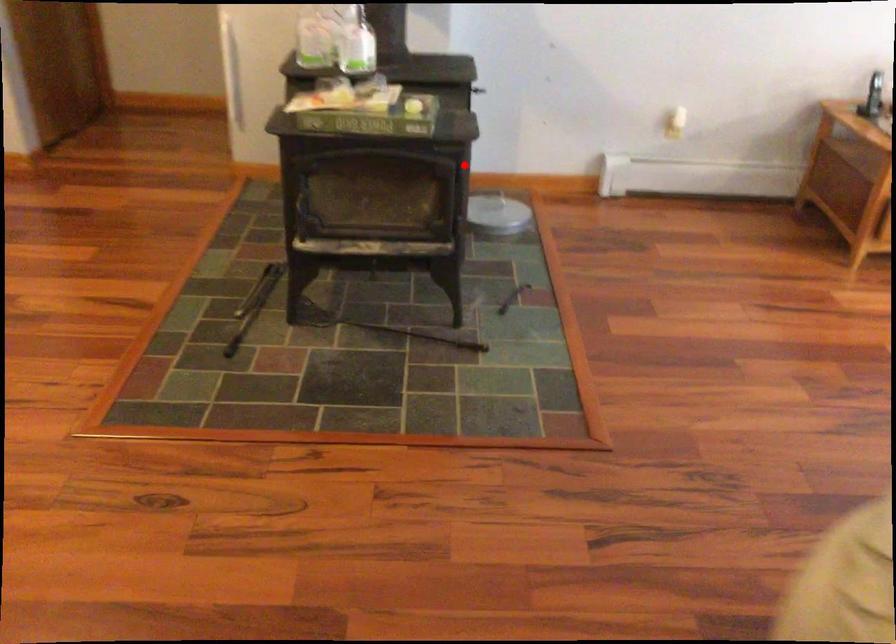
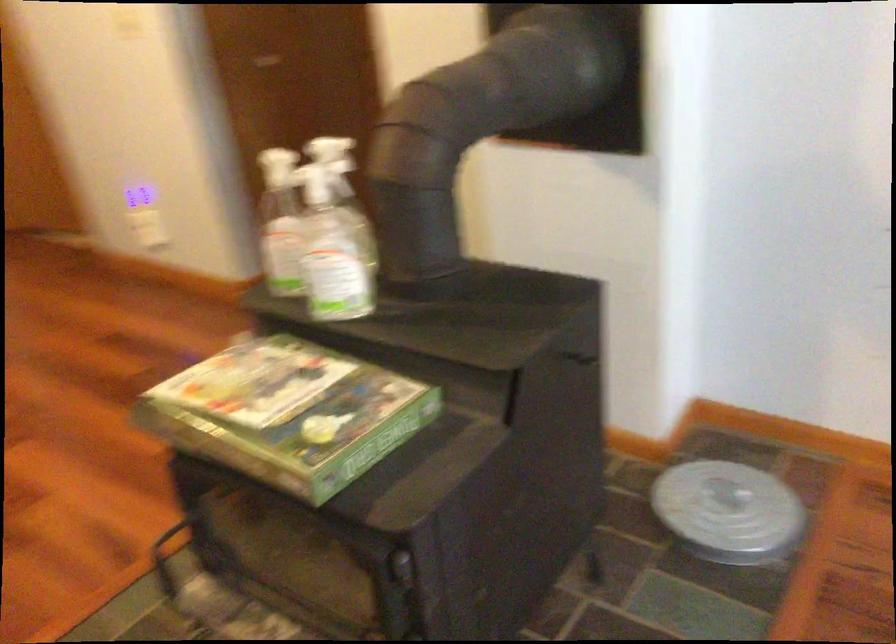
Question: I am providing you with two images of the same scene from different viewpoints. In image1, a red point is highlighted. Considering the same 3D point in image2, which of the following is correct?

Choices:
 (A) It is closer
 (B) It is farther

Answer: (A)